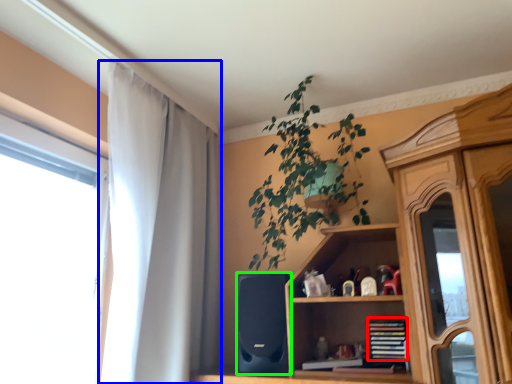
Question: Which is nearer to the book (highlighted by a red box)? curtain (highlighted by a blue box) or speaker (highlighted by a green box).

Choices:
 (A) curtain
 (B) speaker

Answer: (B)